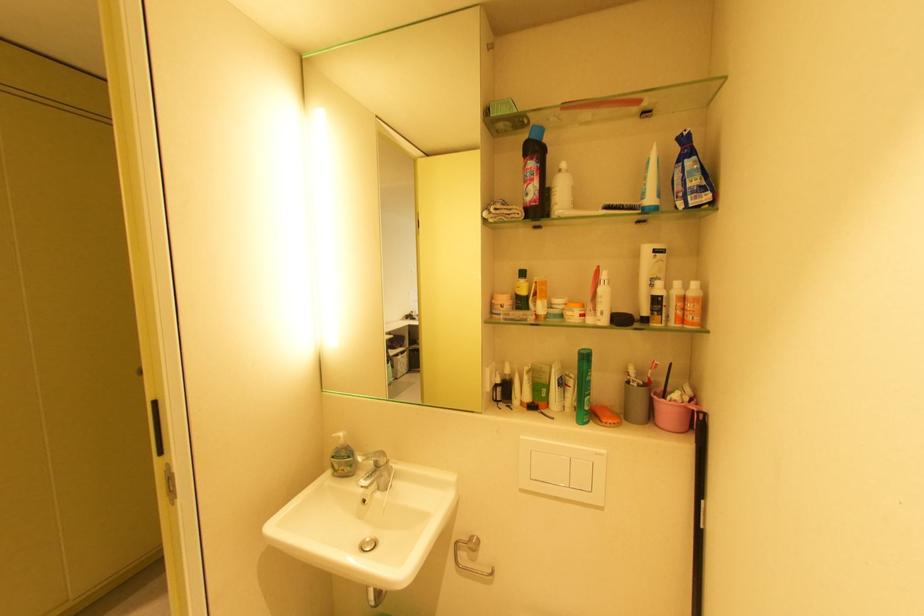
The width and height of the screenshot is (924, 616). Describe the element at coordinates (562, 191) in the screenshot. I see `a white bottle pump` at that location.